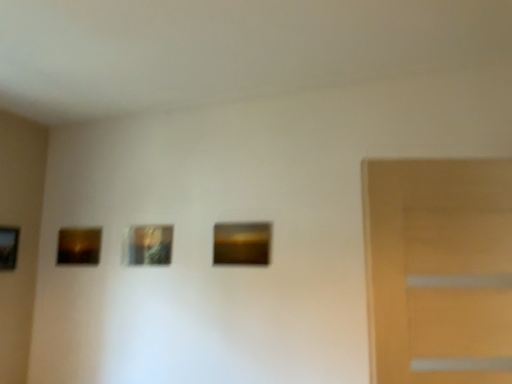
Question: From a real-world perspective, is metallic gold picture frame at center, which is the 2th picture frame in right-to-left order, below wooden picture frame at left, which is the fourth picture frame in right-to-left order?

Choices:
 (A) no
 (B) yes

Answer: (A)

Question: Is metallic gold picture frame at center, which is the 2th picture frame in right-to-left order, oriented away from wooden picture frame at left, which is the fourth picture frame in right-to-left order?

Choices:
 (A) yes
 (B) no

Answer: (B)

Question: Considering the relative sizes of metallic gold picture frame at center, arranged as the third picture frame when viewed from the left, and wooden picture frame at left, which is counted as the first picture frame, starting from the left, in the image provided, is metallic gold picture frame at center, arranged as the third picture frame when viewed from the left, shorter than wooden picture frame at left, which is counted as the first picture frame, starting from the left,?

Choices:
 (A) no
 (B) yes

Answer: (B)

Question: Could you tell me if metallic gold picture frame at center, which is the 2th picture frame in right-to-left order, is turned towards wooden picture frame at left, which is counted as the first picture frame, starting from the left?

Choices:
 (A) yes
 (B) no

Answer: (B)

Question: Is metallic gold picture frame at center, which is the 2th picture frame in right-to-left order, not near wooden picture frame at left, which is counted as the first picture frame, starting from the left?

Choices:
 (A) no
 (B) yes

Answer: (A)

Question: Is metallic gold picture frame at center, which is the 2th picture frame in right-to-left order, in contact with wooden picture frame at left, which is counted as the first picture frame, starting from the left?

Choices:
 (A) no
 (B) yes

Answer: (A)

Question: Does matte brown picture frame at left, the 3th picture frame positioned from the right, have a lesser width compared to wooden picture frame at left, which is the fourth picture frame in right-to-left order?

Choices:
 (A) yes
 (B) no

Answer: (A)

Question: Can we say matte brown picture frame at left, which is the second picture frame in left-to-right order, lies outside wooden picture frame at left, which is counted as the first picture frame, starting from the left?

Choices:
 (A) no
 (B) yes

Answer: (B)

Question: From the image's perspective, would you say matte brown picture frame at left, the 3th picture frame positioned from the right, is positioned over wooden picture frame at left, which is counted as the first picture frame, starting from the left?

Choices:
 (A) yes
 (B) no

Answer: (B)

Question: Would you say wooden picture frame at left, which is counted as the first picture frame, starting from the left, is part of matte brown picture frame at left, the 3th picture frame positioned from the right,'s contents?

Choices:
 (A) yes
 (B) no

Answer: (B)

Question: From a real-world perspective, is matte brown picture frame at left, the 3th picture frame positioned from the right, physically below wooden picture frame at left, which is counted as the first picture frame, starting from the left?

Choices:
 (A) no
 (B) yes

Answer: (A)

Question: Would you consider matte brown picture frame at left, which is the second picture frame in left-to-right order, to be distant from wooden picture frame at left, which is counted as the first picture frame, starting from the left?

Choices:
 (A) yes
 (B) no

Answer: (B)

Question: Does matte brown picture frame at center, which is counted as the 4th picture frame, starting from the left, have a greater height compared to metallic gold picture frame at center, arranged as the third picture frame when viewed from the left?

Choices:
 (A) yes
 (B) no

Answer: (B)